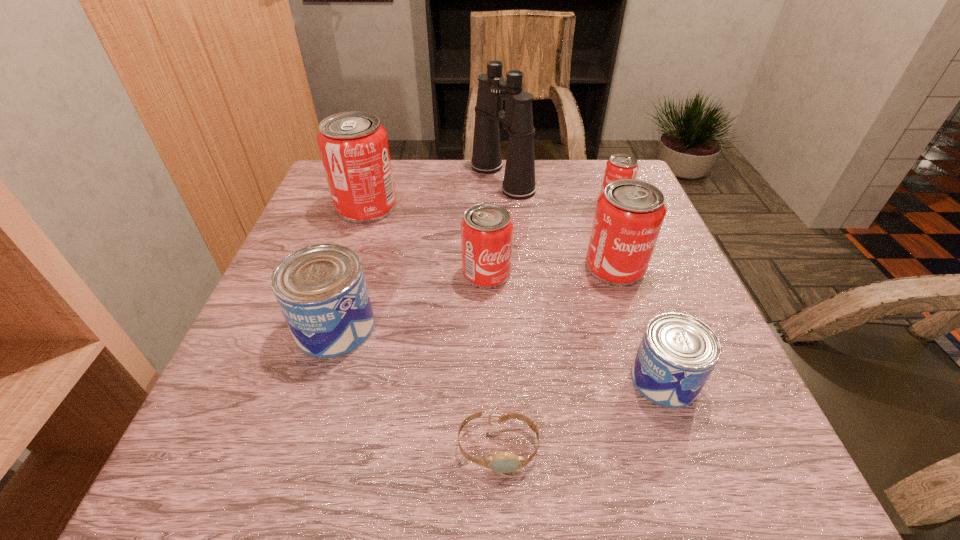
You are a GUI agent. You are given a task and a screenshot of the screen. Output one action in this format:
    pyautogui.click(x=<x>, y=<y>)
    Task: Click on the free region located 0.270m on the front label of the right blue can
    
    Given the screenshot: What is the action you would take?
    pyautogui.click(x=468, y=380)

The height and width of the screenshot is (540, 960). I want to click on binoculars at the far edge, so click(519, 183).

The image size is (960, 540). In order to click on object that is at the near edge in this screenshot , I will do `click(505, 462)`.

The height and width of the screenshot is (540, 960). In order to click on object located at the far left corner in this screenshot , I will do `click(353, 146)`.

At what (x,y) coordinates should I click in order to perform the action: click on object that is at the far right corner. Please return your answer as a coordinate pair (x, y). This screenshot has width=960, height=540. Looking at the image, I should click on (620, 166).

You are a GUI agent. You are given a task and a screenshot of the screen. Output one action in this format:
    pyautogui.click(x=<x>, y=<y>)
    Task: Click on the free space at the far edge
    
    Given the screenshot: What is the action you would take?
    pyautogui.click(x=446, y=177)

The height and width of the screenshot is (540, 960). In order to click on free space at the near edge in this screenshot , I will do `click(339, 453)`.

Where is `vacant space at the left edge of the desktop`? The image size is (960, 540). vacant space at the left edge of the desktop is located at coordinates (262, 387).

Locate an element on the screen. The width and height of the screenshot is (960, 540). vacant space at the right edge of the desktop is located at coordinates (661, 232).

In the image, there is a desktop. Find the location of `free space at the far right corner`. free space at the far right corner is located at coordinates (601, 160).